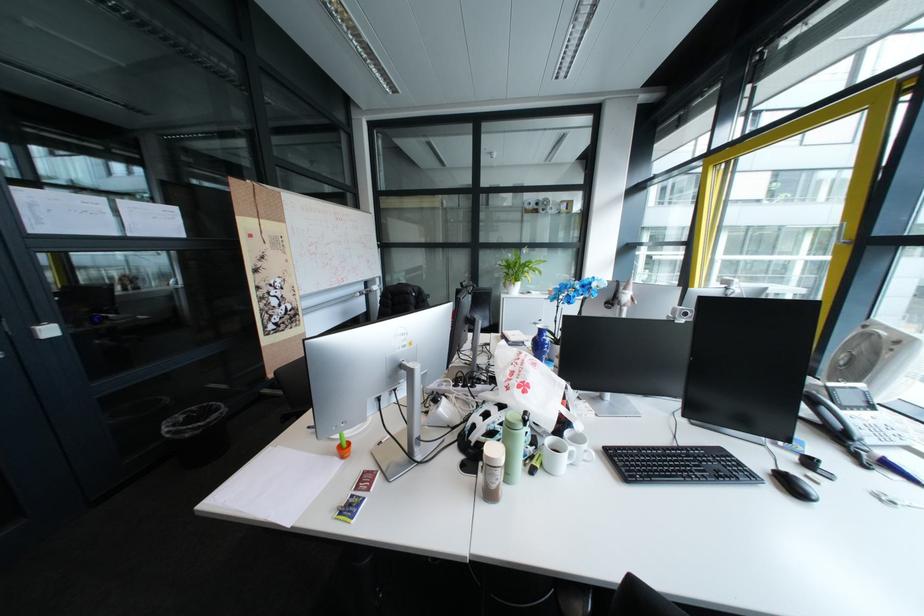
Where would you lift the black waste bin? Please return your answer as a coordinate pair (x, y).

(198, 434)